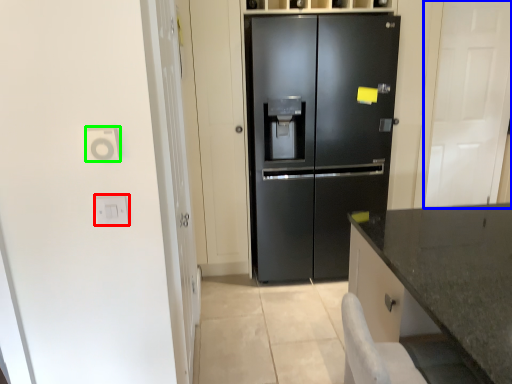
Question: Based on their relative distances, which object is nearer to electric outlet (highlighted by a red box)? Choose from glass door (highlighted by a blue box) and electric outlet (highlighted by a green box).

Choices:
 (A) glass door
 (B) electric outlet

Answer: (B)